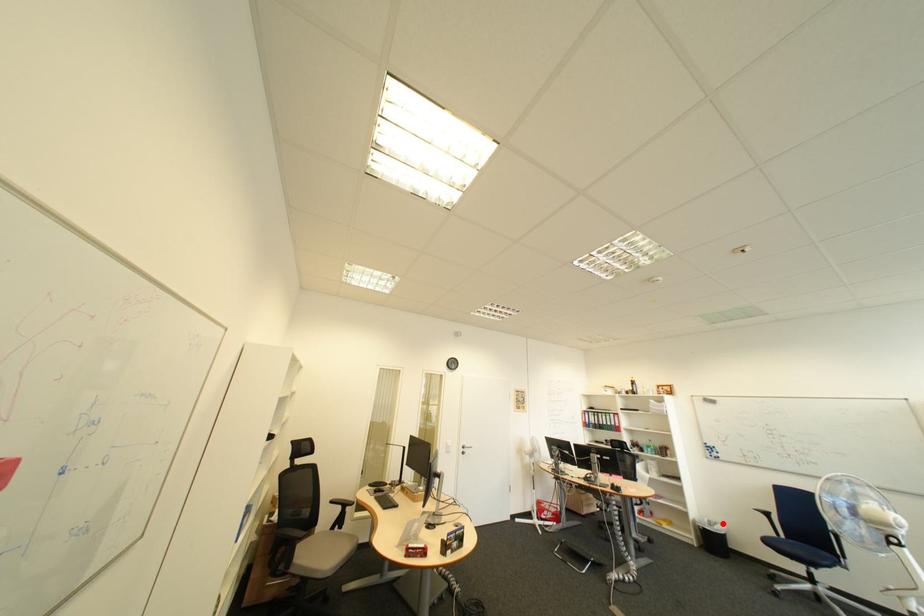
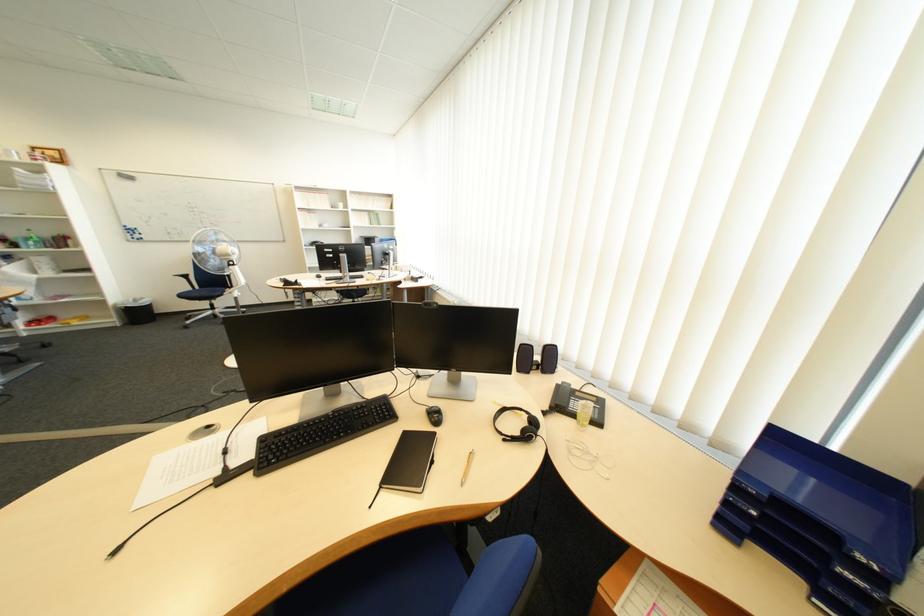
Question: I am providing you with two images of the same scene from different viewpoints. A red point is marked on the first image. Can you still see the location of the red point in image 2?

Choices:
 (A) Yes
 (B) No

Answer: (A)